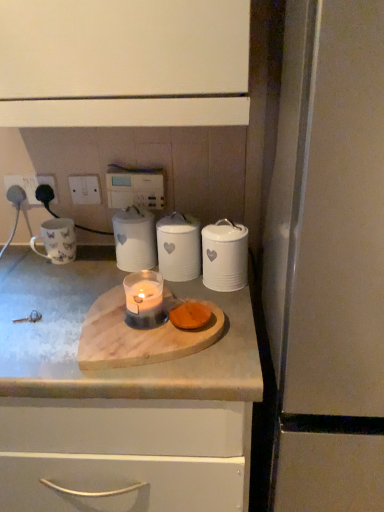
You are a GUI agent. You are given a task and a screenshot of the screen. Output one action in this format:
    pyautogui.click(x=<x>, y=<y>)
    Task: Click on the vacant space to the left of white ceramic canister at center, the 1th kitchen appliance viewed from the left
    
    Given the screenshot: What is the action you would take?
    pyautogui.click(x=76, y=273)